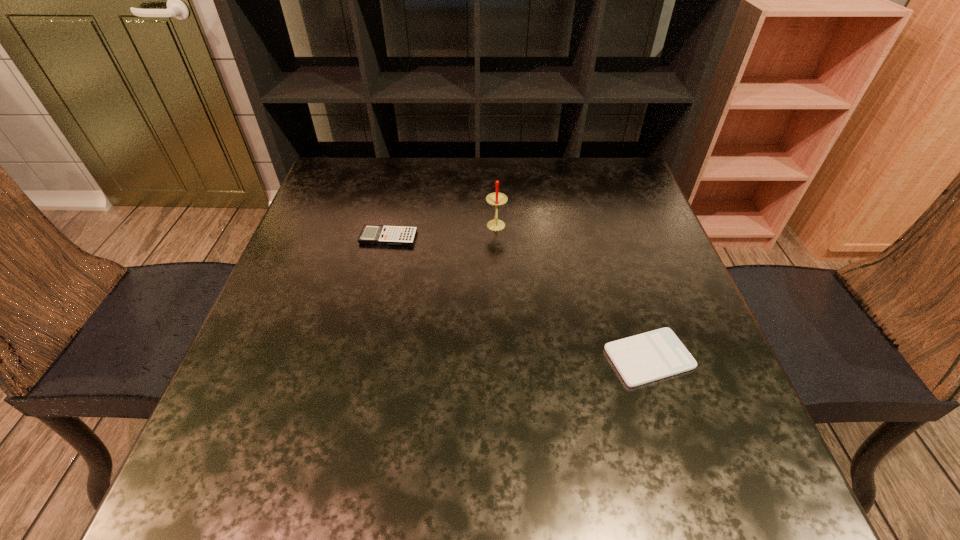
Identify the location of candle. [x=496, y=199].

This screenshot has width=960, height=540. Identify the location of the second object from left to right. (496, 199).

At what (x,y) coordinates should I click in order to perform the action: click on the farther calculator. Please return your answer as a coordinate pair (x, y). This screenshot has height=540, width=960. Looking at the image, I should click on (371, 234).

The width and height of the screenshot is (960, 540). I want to click on the left calculator, so click(x=371, y=234).

I want to click on the right calculator, so click(643, 358).

Locate an element on the screen. Image resolution: width=960 pixels, height=540 pixels. the nearer calculator is located at coordinates (643, 358).

At what (x,y) coordinates should I click in order to perform the action: click on vacant area located 0.050m on the front of the second object from left to right. Please return your answer as a coordinate pair (x, y). The image size is (960, 540). Looking at the image, I should click on (497, 249).

Image resolution: width=960 pixels, height=540 pixels. I want to click on blank space located 0.170m on the right of the left calculator, so click(x=487, y=237).

You are a GUI agent. You are given a task and a screenshot of the screen. Output one action in this format:
    pyautogui.click(x=<x>, y=<y>)
    Task: Click on the vacant space located 0.280m on the left of the rightmost object
    Image resolution: width=960 pixels, height=540 pixels.
    Given the screenshot: What is the action you would take?
    pyautogui.click(x=456, y=357)

In order to click on object positioned at the left edge in this screenshot , I will do `click(371, 234)`.